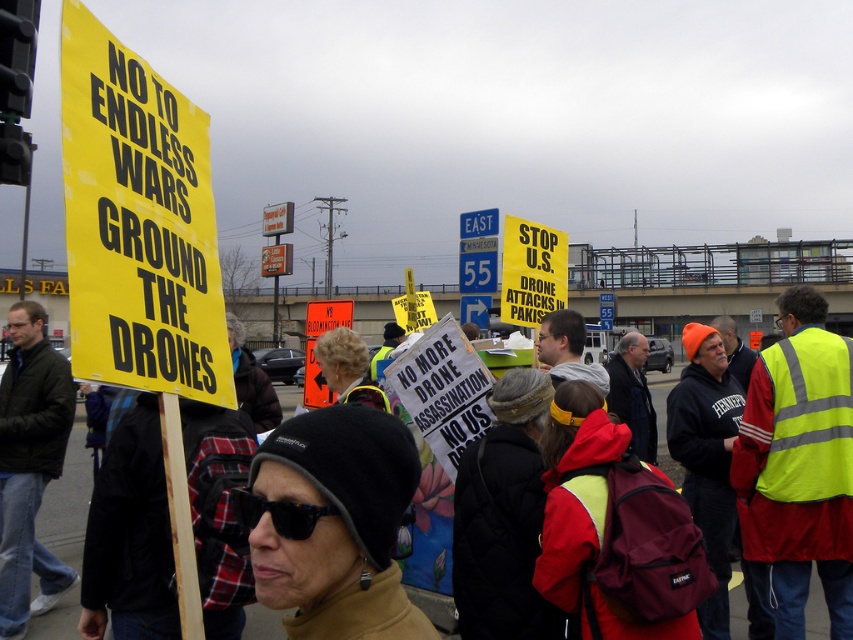
You are a photographer trying to capture a clear shot of both the dark green jacket at left and the black plastic sunglasses at center. Based on their positions, which object should you focus on first to ensure both are in frame?

The dark green jacket at left is positioned on the left side of black plastic sunglasses at center. To ensure both are in frame, focus on the dark green jacket at left first as it is on the left edge, then adjust to include the black plastic sunglasses at center.

You are a photographer trying to capture a clear shot of both the yellow paper sign at left and the black plastic sunglasses at center. Given their sizes, which object will appear bigger in your photo?

The yellow paper sign at left will appear bigger in the photo because it is larger in size than the black plastic sunglasses at center.

You are a photographer standing at the camera position. You want to take a photo of the yellow paper sign at left. Can you reach it without moving the camera? The camera has a 20 feet range.

The yellow paper sign at left and camera are 4.64 feet apart, so yes, you can reach it without moving the camera since the distance is within the camera range of 20 feet.